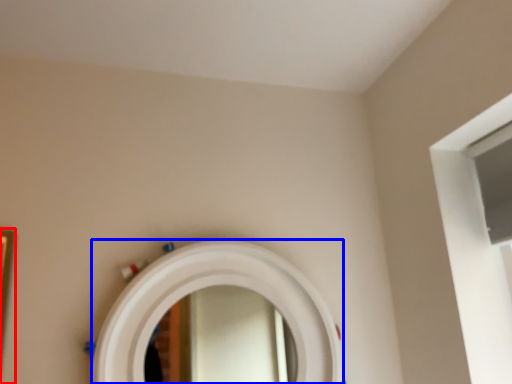
Question: Which of the following is the closest to the observer, picture frame (highlighted by a red box) or mirror (highlighted by a blue box)?

Choices:
 (A) picture frame
 (B) mirror

Answer: (A)